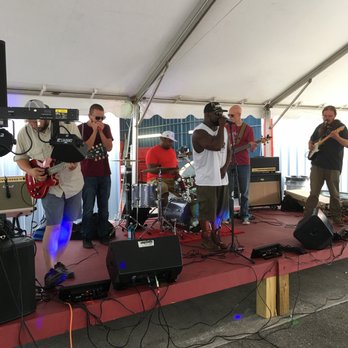
Image resolution: width=348 pixels, height=348 pixels. I want to click on monitor, so click(152, 257).